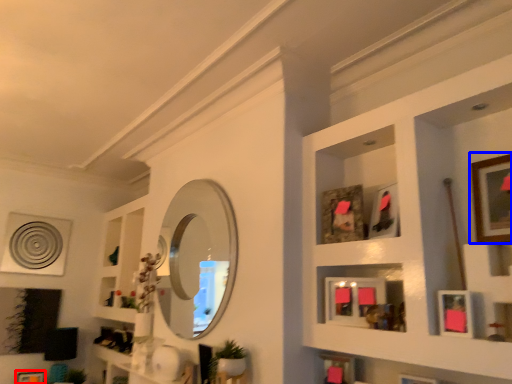
Question: Which of the following is the farthest to the observer, picture frame (highlighted by a red box) or picture frame (highlighted by a blue box)?

Choices:
 (A) picture frame
 (B) picture frame

Answer: (A)